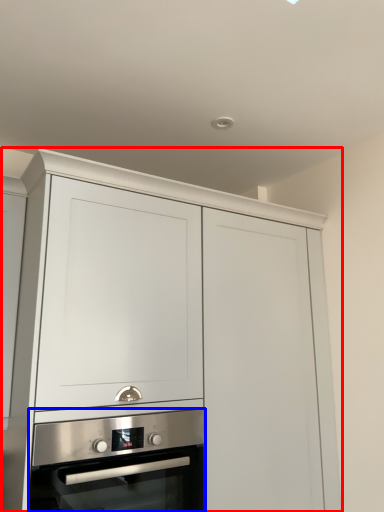
Question: Which object appears closest to the camera in this image, cabinetry (highlighted by a red box) or oven (highlighted by a blue box)?

Choices:
 (A) cabinetry
 (B) oven

Answer: (A)